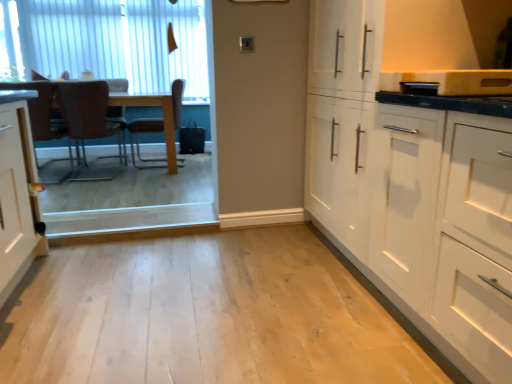
Question: From a real-world perspective, is white vertical blinds at upper left below light wood floor at center?

Choices:
 (A) yes
 (B) no

Answer: (B)

Question: Can you confirm if white vertical blinds at upper left is smaller than light wood floor at center?

Choices:
 (A) no
 (B) yes

Answer: (A)

Question: Does white vertical blinds at upper left have a lesser height compared to light wood floor at center?

Choices:
 (A) no
 (B) yes

Answer: (A)

Question: Is white vertical blinds at upper left positioned behind light wood floor at center?

Choices:
 (A) yes
 (B) no

Answer: (A)

Question: Is white vertical blinds at upper left closer to the viewer compared to light wood floor at center?

Choices:
 (A) no
 (B) yes

Answer: (A)

Question: Choose the correct answer: Is brown leather chair at left, which is counted as the second chair, starting from the right, inside brown leather chair at left, which is counted as the 1th chair, starting from the left, or outside it?

Choices:
 (A) inside
 (B) outside

Answer: (B)

Question: Considering their positions, is brown leather chair at left, which is counted as the second chair, starting from the right, located in front of or behind brown leather chair at left, which is counted as the 1th chair, starting from the left?

Choices:
 (A) behind
 (B) front

Answer: (A)

Question: Looking at their shapes, would you say brown leather chair at left, the 2th chair viewed from the left, is wider or thinner than brown leather chair at left, which is counted as the third chair, starting from the right?

Choices:
 (A) thin
 (B) wide

Answer: (B)

Question: Is point (115, 124) closer or farther from the camera than point (35, 89)?

Choices:
 (A) farther
 (B) closer

Answer: (A)

Question: Is brown leather chair at left, which is counted as the 1th chair, starting from the left, inside the boundaries of light wood floor at center, or outside?

Choices:
 (A) outside
 (B) inside

Answer: (A)

Question: Relative to light wood floor at center, is brown leather chair at left, which is counted as the third chair, starting from the right, in front or behind?

Choices:
 (A) behind
 (B) front

Answer: (A)

Question: In the image, is brown leather chair at left, which is counted as the third chair, starting from the right, on the left side or the right side of light wood floor at center?

Choices:
 (A) right
 (B) left

Answer: (B)

Question: From a real-world perspective, is brown leather chair at left, which is counted as the third chair, starting from the right, above or below light wood floor at center?

Choices:
 (A) above
 (B) below

Answer: (A)

Question: Would you say brown leather chair at left, which is counted as the second chair, starting from the right, is to the left or to the right of brown fabric armchair at left in the picture?

Choices:
 (A) right
 (B) left

Answer: (A)

Question: From their relative heights in the image, would you say brown leather chair at left, which is counted as the second chair, starting from the right, is taller or shorter than brown fabric armchair at left?

Choices:
 (A) short
 (B) tall

Answer: (B)